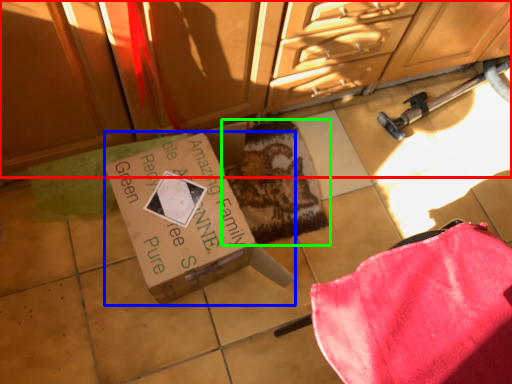
Question: Based on their relative distances, which object is farther from cabinetry (highlighted by a red box)? Choose from box (highlighted by a blue box) and mat (highlighted by a green box).

Choices:
 (A) box
 (B) mat

Answer: (A)